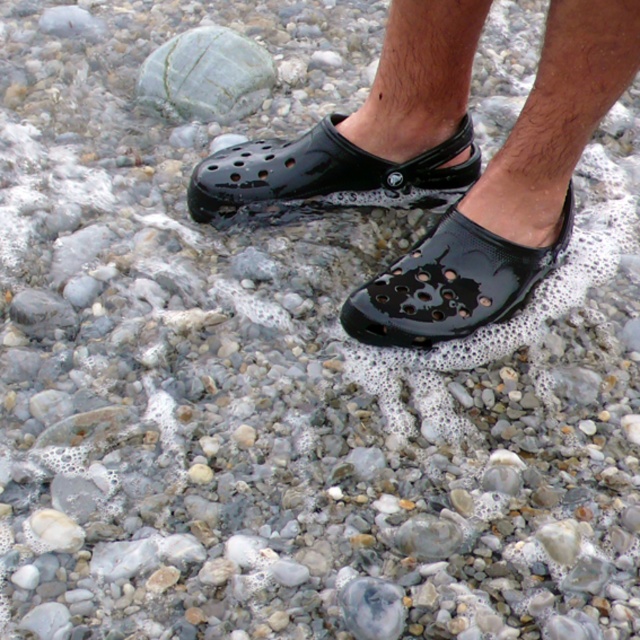
Question: Which object is closer to the camera taking this photo?

Choices:
 (A) green marble rock at upper left
 (B) glossy black clog at center
 (C) glossy plastic shoes at center

Answer: (C)

Question: Which of the following is the farthest from the observer?

Choices:
 (A) (301, 208)
 (B) (224, 90)
 (C) (433, 252)

Answer: (B)

Question: Does glossy black clog at center come in front of green marble rock at upper left?

Choices:
 (A) no
 (B) yes

Answer: (B)

Question: Among these objects, which one is farthest from the camera?

Choices:
 (A) green marble rock at upper left
 (B) glossy black clog at center
 (C) glossy plastic shoes at center

Answer: (A)

Question: Is glossy black clog at center in front of green marble rock at upper left?

Choices:
 (A) no
 (B) yes

Answer: (B)

Question: Where is glossy plastic shoes at center located in relation to glossy black clog at center in the image?

Choices:
 (A) above
 (B) below

Answer: (A)